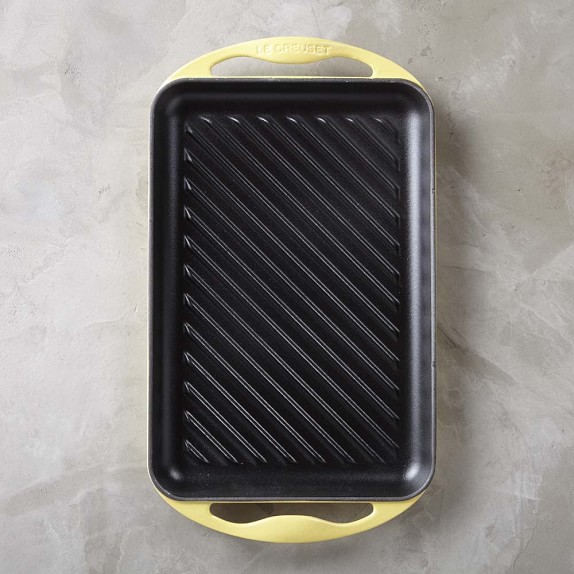
I want to click on hotplate, so click(297, 366).